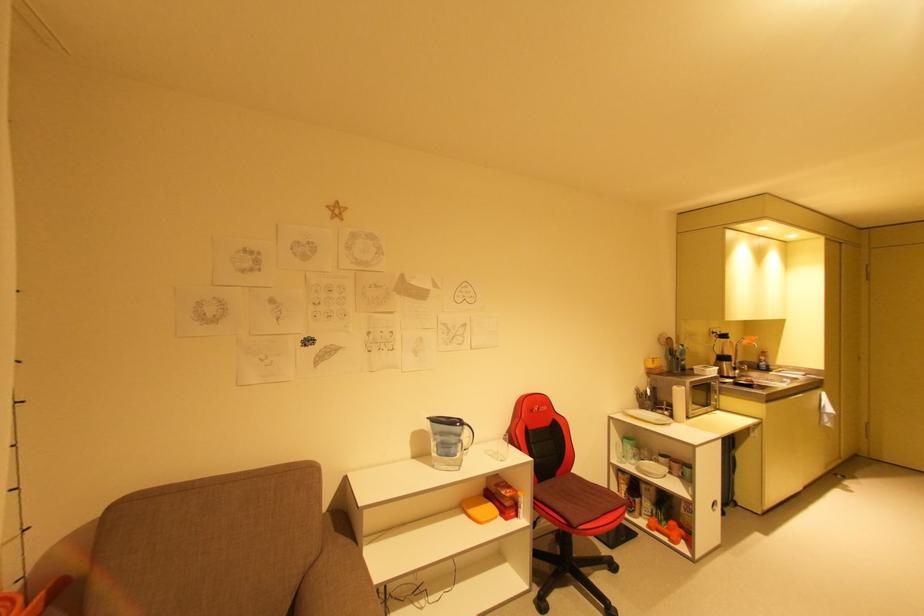
The height and width of the screenshot is (616, 924). What do you see at coordinates (746, 352) in the screenshot?
I see `the silver faucet handle` at bounding box center [746, 352].